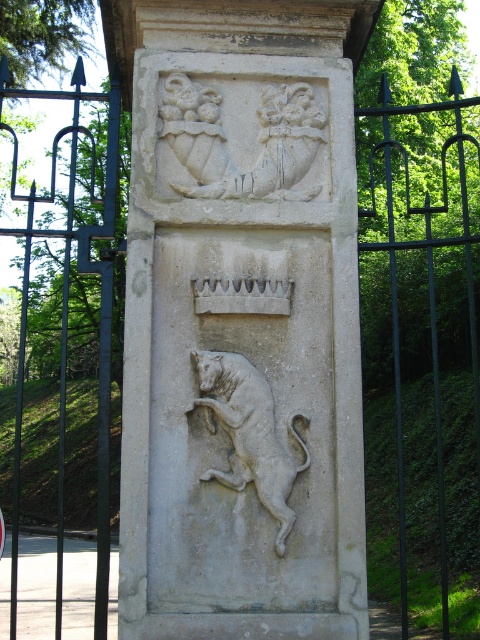
Based on the photo, you are standing in front of the stone pillar and want to locate the white stone coat of arms at upper center. Based on the coordinates given, can you determine its exact location relative to the center of the pillar?

The white stone coat of arms at upper center is located at coordinates point (226, 140), which means it is positioned slightly to the left and above the center of the pillar.

You are an architect designing a new gate. You want to place a decorative element between the white stone coat of arms at upper center and the white stone lion at center. Based on their widths, which one should the new element be placed closer to?

The white stone coat of arms at upper center might be wider than the white stone lion at center, so the new decorative element should be placed closer to the white stone coat of arms at upper center to maintain balance.